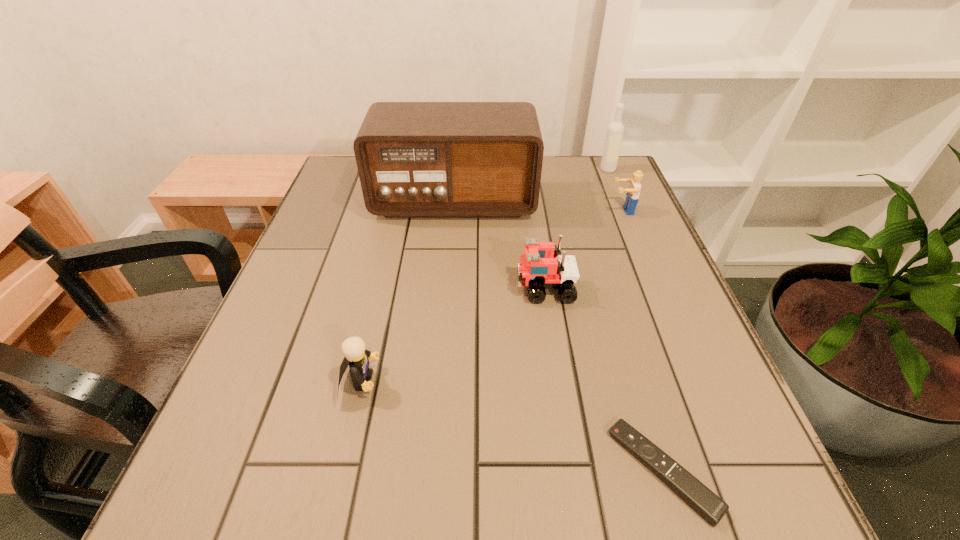
Find the location of a particular element. This screenshot has height=540, width=960. the tallest object is located at coordinates pos(415,159).

Where is `vodka`? vodka is located at coordinates (615, 130).

I want to click on the second tallest object, so click(x=615, y=130).

In order to click on the second Lego from left to right in this screenshot , I will do `click(536, 272)`.

Find the location of a particular element. the second nearest Lego is located at coordinates (536, 272).

Where is `the rightmost Lego`? the rightmost Lego is located at coordinates (632, 196).

Where is `the leftmost Lego`? the leftmost Lego is located at coordinates (357, 357).

This screenshot has height=540, width=960. I want to click on the nearest Lego, so click(357, 357).

The width and height of the screenshot is (960, 540). What are the coordinates of `remote control` in the screenshot? It's located at (707, 504).

You are a GUI agent. You are given a task and a screenshot of the screen. Output one action in this format:
    pyautogui.click(x=<x>, y=<y>)
    Task: Click on the nearest object
    
    Given the screenshot: What is the action you would take?
    pyautogui.click(x=707, y=504)